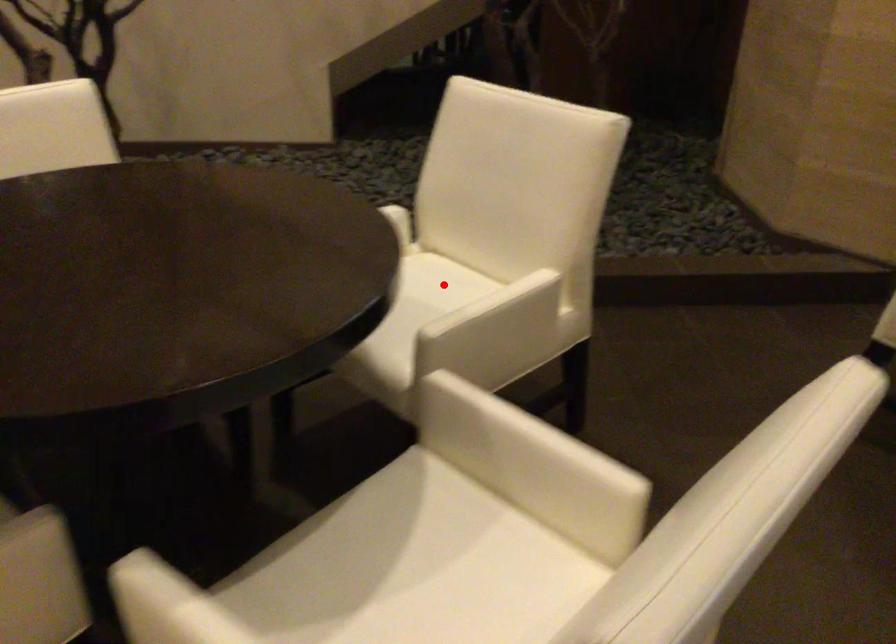
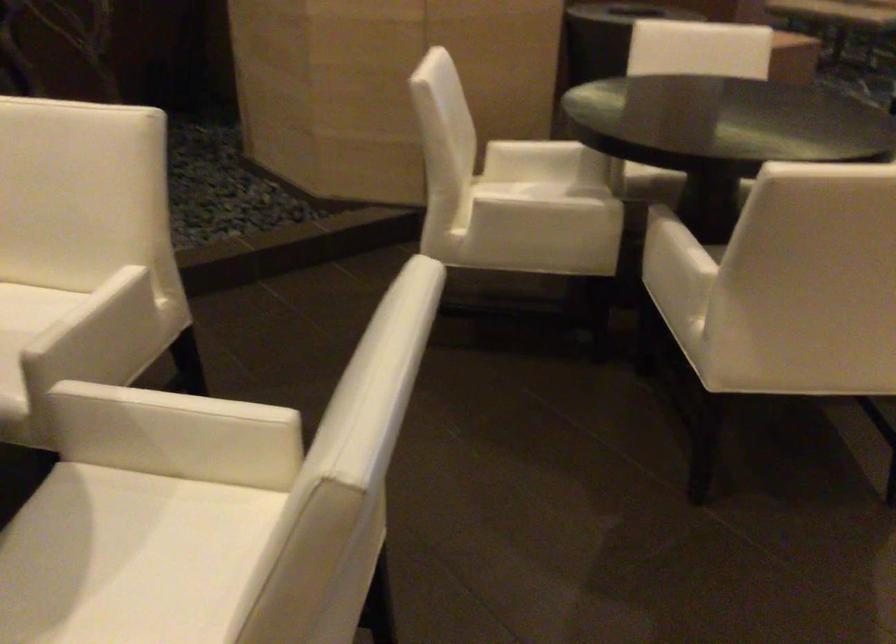
Find the pixel in the second image that matches the highlighted location in the first image.

(24, 308)